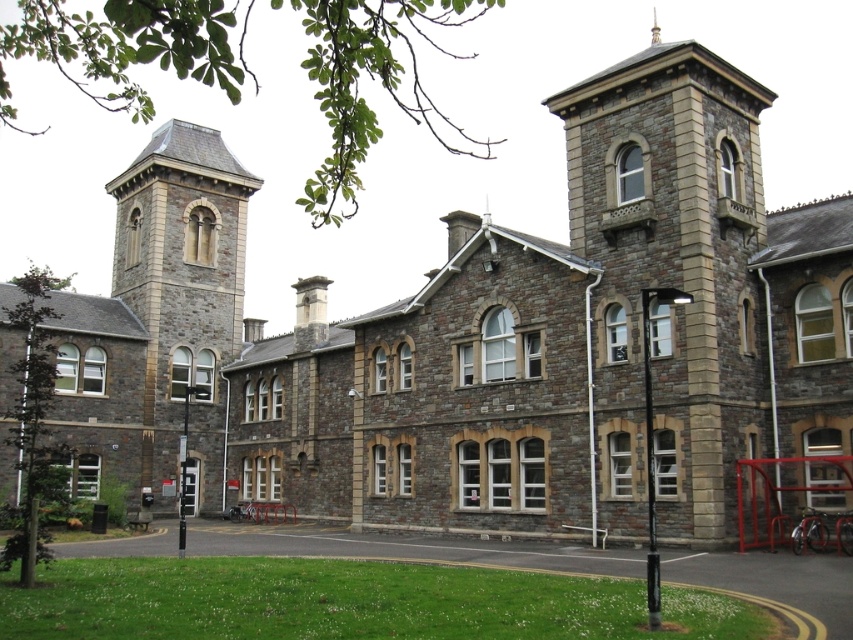
Question: Does stone tower at center have a smaller size compared to gray stone tower at left?

Choices:
 (A) no
 (B) yes

Answer: (A)

Question: Which of the following is the farthest from the observer?

Choices:
 (A) gray stone tower at left
 (B) stone tower at center

Answer: (A)

Question: Does stone tower at center have a larger size compared to gray stone tower at left?

Choices:
 (A) yes
 (B) no

Answer: (A)

Question: Is stone tower at center further to the viewer compared to gray stone tower at left?

Choices:
 (A) no
 (B) yes

Answer: (A)